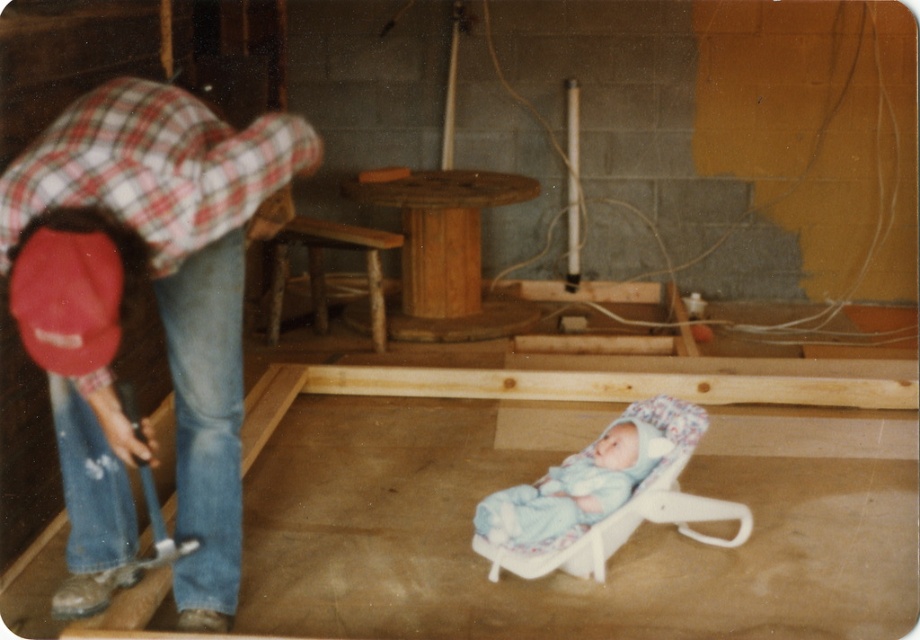
Question: Is blue soft fabric newborn at center to the left of wooden rustic chair at center from the viewer's perspective?

Choices:
 (A) yes
 (B) no

Answer: (B)

Question: Among these objects, which one is nearest to the camera?

Choices:
 (A) white fabric baby carriage at center
 (B) blue soft fabric newborn at center

Answer: (A)

Question: From the image, what is the correct spatial relationship of red plaid shirt at left in relation to wooden rustic chair at center?

Choices:
 (A) above
 (B) below

Answer: (B)

Question: Is red plaid shirt at left closer to the viewer compared to blue soft fabric newborn at center?

Choices:
 (A) yes
 (B) no

Answer: (A)

Question: Among these objects, which one is farthest from the camera?

Choices:
 (A) blue soft fabric newborn at center
 (B) white fabric baby carriage at center
 (C) red plaid shirt at left

Answer: (A)

Question: Which point is closer to the camera taking this photo?

Choices:
 (A) (213, 348)
 (B) (657, 444)
 (C) (398, 234)
 (D) (506, 515)

Answer: (A)